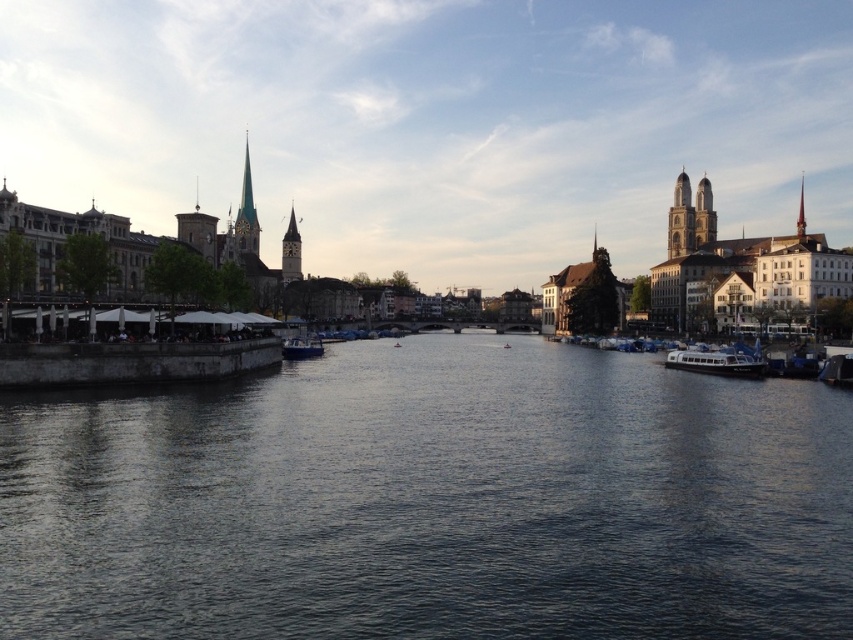
Between smooth stone tower at upper right and smooth stone clock tower at center, which one is positioned lower?

smooth stone clock tower at center

Where is `smooth stone tower at upper right`? The image size is (853, 640). smooth stone tower at upper right is located at coordinates (703, 214).

Locate an element on the screen. The width and height of the screenshot is (853, 640). smooth stone tower at upper right is located at coordinates (703, 214).

Based on the photo, does dark blue water at center appear on the left side of smooth stone clock tower at center?

In fact, dark blue water at center is to the right of smooth stone clock tower at center.

Which is below, dark blue water at center or smooth stone clock tower at center?

Positioned lower is dark blue water at center.

You are a GUI agent. You are given a task and a screenshot of the screen. Output one action in this format:
    pyautogui.click(x=<x>, y=<y>)
    Task: Click on the dark blue water at center
    
    Given the screenshot: What is the action you would take?
    (431, 500)

Is white glossy boat at right above smooth stone spire at upper left?

Incorrect, white glossy boat at right is not positioned above smooth stone spire at upper left.

How distant is white glossy boat at right from smooth stone spire at upper left?

white glossy boat at right is 317.95 feet from smooth stone spire at upper left.

Which is behind, point (747, 362) or point (238, 259)?

The point (238, 259) is more distant.

At what (x,y) coordinates should I click in order to perform the action: click on white glossy boat at right. Please return your answer as a coordinate pair (x, y). Image resolution: width=853 pixels, height=640 pixels. Looking at the image, I should click on (715, 362).